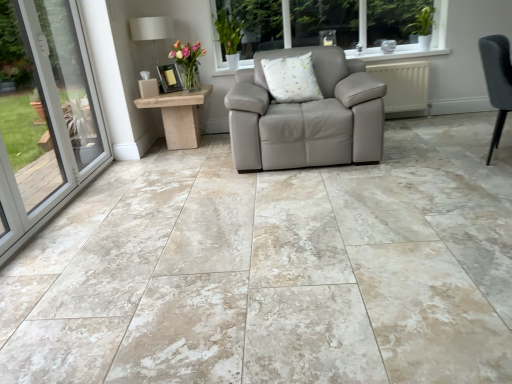
Question: Is translucent glass vase at upper center taller than beige marble floor at center?

Choices:
 (A) no
 (B) yes

Answer: (B)

Question: Considering the relative sizes of translucent glass vase at upper center and beige marble floor at center in the image provided, is translucent glass vase at upper center thinner than beige marble floor at center?

Choices:
 (A) yes
 (B) no

Answer: (A)

Question: From the image's perspective, is translucent glass vase at upper center above beige marble floor at center?

Choices:
 (A) no
 (B) yes

Answer: (B)

Question: Does translucent glass vase at upper center appear on the right side of beige marble floor at center?

Choices:
 (A) yes
 (B) no

Answer: (B)

Question: Is translucent glass vase at upper center to the left of beige marble floor at center from the viewer's perspective?

Choices:
 (A) yes
 (B) no

Answer: (A)

Question: In the image, is beige marble floor at center on the left side or the right side of translucent glass vase at upper center?

Choices:
 (A) right
 (B) left

Answer: (A)

Question: Is beige marble floor at center taller or shorter than translucent glass vase at upper center?

Choices:
 (A) tall
 (B) short

Answer: (B)

Question: Would you say beige marble floor at center is inside or outside translucent glass vase at upper center?

Choices:
 (A) inside
 (B) outside

Answer: (B)

Question: Looking at their shapes, would you say beige marble floor at center is wider or thinner than translucent glass vase at upper center?

Choices:
 (A) wide
 (B) thin

Answer: (A)

Question: Would you say white fabric lampshade at upper left is to the left or to the right of wooden side table at left in the picture?

Choices:
 (A) left
 (B) right

Answer: (A)

Question: Relative to wooden side table at left, is white fabric lampshade at upper left in front or behind?

Choices:
 (A) behind
 (B) front

Answer: (A)

Question: Is white fabric lampshade at upper left taller or shorter than wooden side table at left?

Choices:
 (A) tall
 (B) short

Answer: (A)

Question: Is point (138, 33) positioned closer to the camera than point (181, 144)?

Choices:
 (A) closer
 (B) farther

Answer: (B)

Question: Considering the positions of white fabric lampshade at upper left and beige marble floor at center in the image, is white fabric lampshade at upper left wider or thinner than beige marble floor at center?

Choices:
 (A) wide
 (B) thin

Answer: (B)

Question: From their relative heights in the image, would you say white fabric lampshade at upper left is taller or shorter than beige marble floor at center?

Choices:
 (A) short
 (B) tall

Answer: (B)